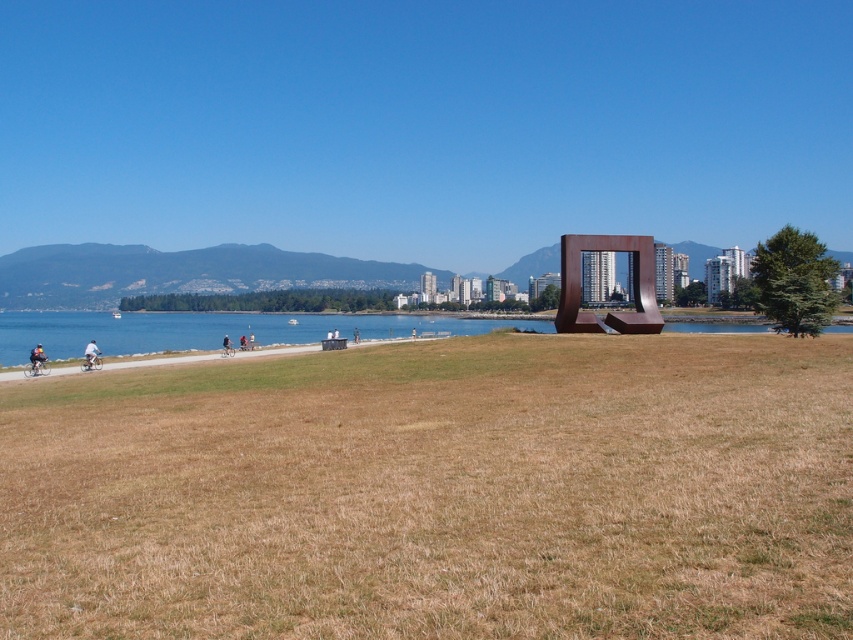
Question: Is light blue fabric at center above blue fabric jacket at center?

Choices:
 (A) no
 (B) yes

Answer: (A)

Question: Which object appears farthest from the camera in this image?

Choices:
 (A) brown dry grass at center
 (B) green grass at lower center
 (C) rustic metal sculpture at center

Answer: (B)

Question: Which object appears closest to the camera in this image?

Choices:
 (A) green grass at lower center
 (B) light blue fabric at center
 (C) rustic metal sculpture at center

Answer: (C)

Question: Which point is farther to the camera?

Choices:
 (A) blue fabric jacket at center
 (B) green grass at lower center
 (C) rustic metal sculpture at center

Answer: (A)

Question: Can you confirm if brown dry grass at center is positioned to the right of green grass at lower center?

Choices:
 (A) no
 (B) yes

Answer: (B)

Question: Does brown dry grass at center lie behind blue fabric jacket at center?

Choices:
 (A) yes
 (B) no

Answer: (B)